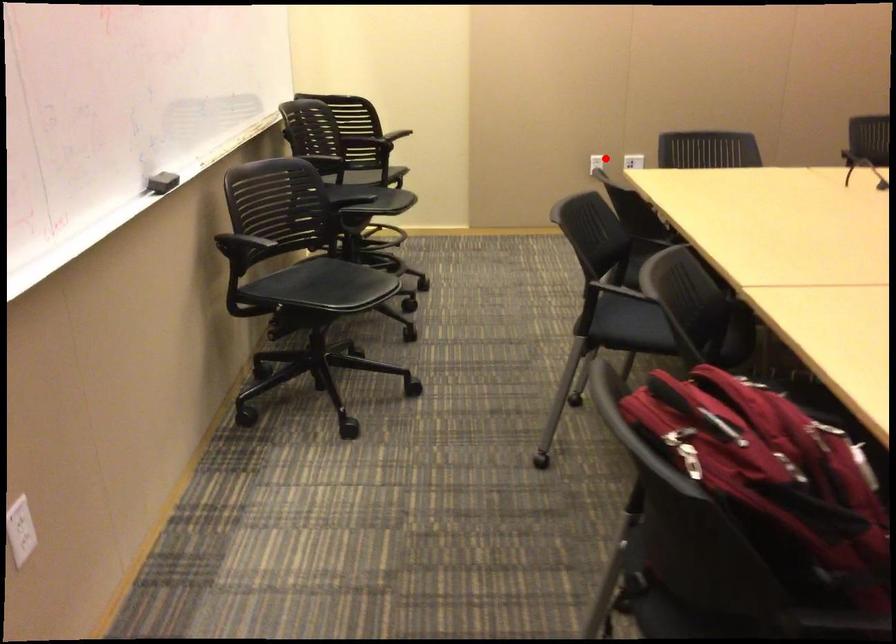
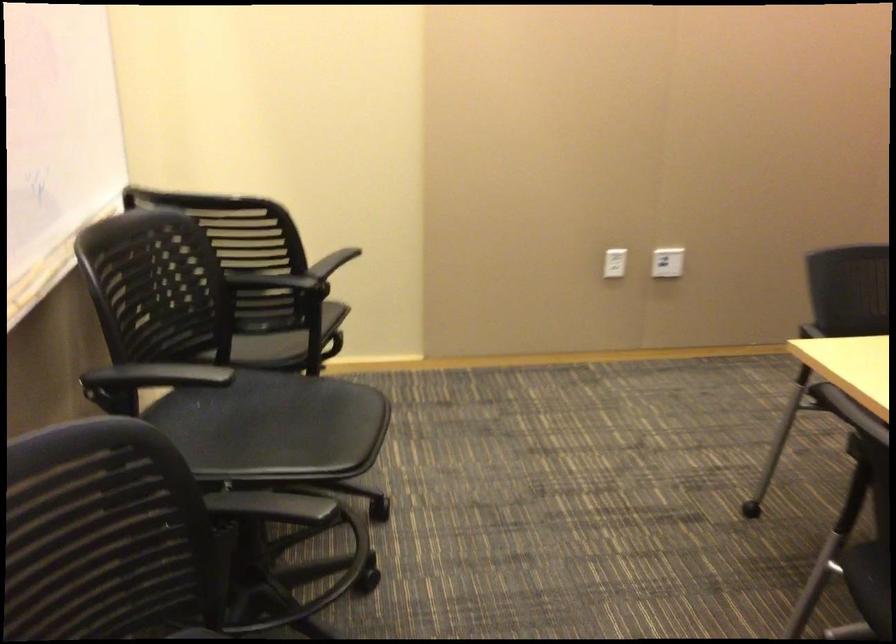
In the second image, find the point that corresponds to the highlighted location in the first image.

(615, 263)